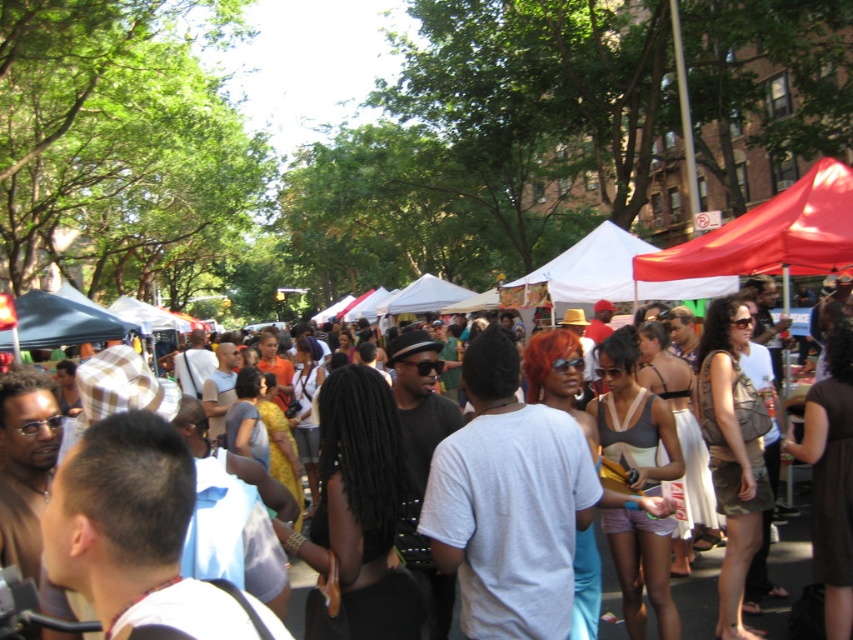
Question: Which object is closer to the camera taking this photo?

Choices:
 (A) matte black hat at center
 (B) red fabric canopy at upper right

Answer: (B)

Question: Can you confirm if red fabric canopy at upper right is positioned to the left of matte black hat at center?

Choices:
 (A) no
 (B) yes

Answer: (B)

Question: Does red fabric canopy at upper right appear over matte black hat at center?

Choices:
 (A) yes
 (B) no

Answer: (A)

Question: Among these objects, which one is nearest to the camera?

Choices:
 (A) matte black hat at center
 (B) red fabric canopy at upper right

Answer: (B)

Question: From the image, what is the correct spatial relationship of red fabric canopy at upper right in relation to matte black hat at center?

Choices:
 (A) above
 (B) below

Answer: (A)